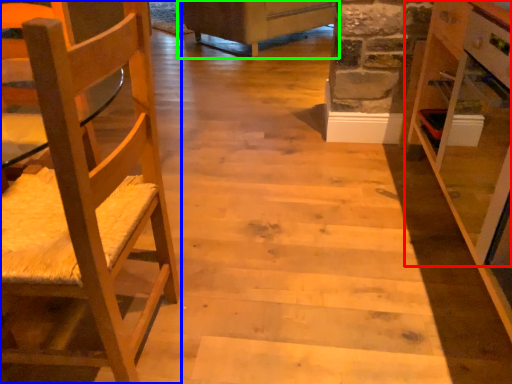
Question: Which object is positioned farthest from cabinetry (highlighted by a red box)? Select from chair (highlighted by a blue box) and furniture (highlighted by a green box).

Choices:
 (A) chair
 (B) furniture

Answer: (B)